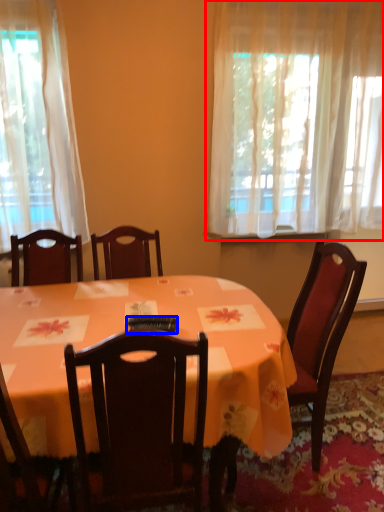
Question: Which of the following is the closest to the observer, curtain (highlighted by a red box) or remote control (highlighted by a blue box)?

Choices:
 (A) curtain
 (B) remote control

Answer: (B)